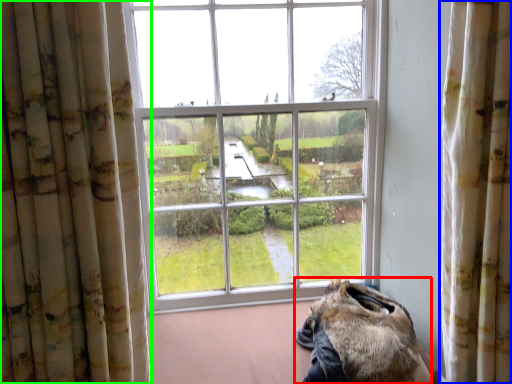
Question: Considering the real-world distances, which object is farthest from animal (highlighted by a red box)? curtain (highlighted by a blue box) or curtain (highlighted by a green box)?

Choices:
 (A) curtain
 (B) curtain

Answer: (B)